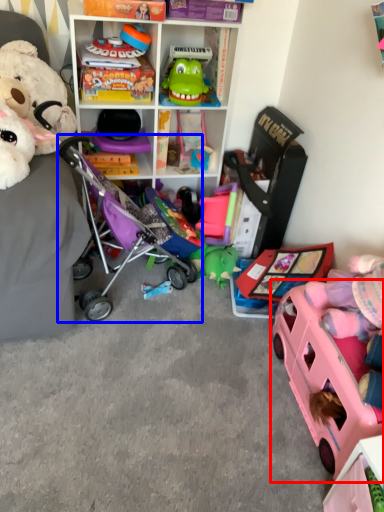
Question: Among these objects, which one is nearest to the camera, toy (highlighted by a red box) or baby carriage (highlighted by a blue box)?

Choices:
 (A) toy
 (B) baby carriage

Answer: (A)